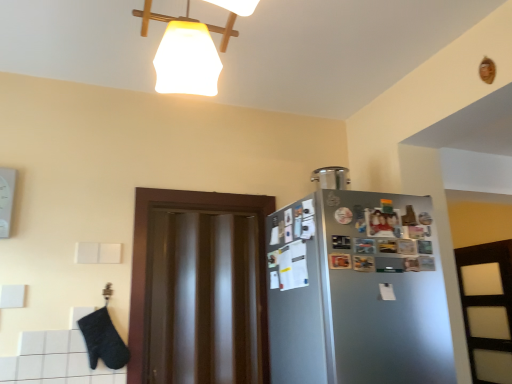
The width and height of the screenshot is (512, 384). Describe the element at coordinates (199, 288) in the screenshot. I see `transparent glossy door at center` at that location.

The height and width of the screenshot is (384, 512). In order to click on satin silver fridge at right in this screenshot , I will do coord(356,292).

Locate an element on the screen. satin silver container at upper right is located at coordinates (331, 177).

Which is in front, point (291, 344) or point (327, 170)?

The point (291, 344) is closer to the camera.

From the image's perspective, is satin silver fridge at right positioned above or below satin silver container at upper right?

satin silver fridge at right is below satin silver container at upper right.

From a real-world perspective, is satin silver fridge at right on top of satin silver container at upper right?

No, from a real-world perspective, satin silver fridge at right is not over satin silver container at upper right

Could you tell me if satin silver fridge at right is facing satin silver container at upper right?

No, satin silver fridge at right is not oriented towards satin silver container at upper right.

Considering the sizes of objects satin silver container at upper right and satin silver fridge at right in the image provided, who is shorter, satin silver container at upper right or satin silver fridge at right?

With less height is satin silver container at upper right.

Considering the sizes of objects satin silver container at upper right and satin silver fridge at right in the image provided, who is smaller, satin silver container at upper right or satin silver fridge at right?

satin silver container at upper right.

Does satin silver container at upper right contain satin silver fridge at right?

That's incorrect, satin silver fridge at right is not inside satin silver container at upper right.

Does satin silver container at upper right lie in front of satin silver fridge at right?

No, it is behind satin silver fridge at right.

Which object is more forward, satin silver container at upper right or transparent glossy door at center?

transparent glossy door at center.

Based on the photo, is satin silver container at upper right aimed at transparent glossy door at center?

No, satin silver container at upper right is not aimed at transparent glossy door at center.

Locate an element on the screen. appliance on the right of transparent glossy door at center is located at coordinates (331, 177).

Can transparent glossy door at center be found inside satin silver container at upper right?

No, transparent glossy door at center is located outside of satin silver container at upper right.

In terms of size, does transparent glossy door at center appear bigger or smaller than satin silver fridge at right?

transparent glossy door at center is smaller than satin silver fridge at right.

Based on the photo, is transparent glossy door at center oriented away from satin silver fridge at right?

No, transparent glossy door at center is not facing the opposite direction of satin silver fridge at right.

Which object is closer to the camera, transparent glossy door at center or satin silver fridge at right?

Positioned in front is satin silver fridge at right.

From the picture: In the image, is transparent glossy door at center positioned in front of or behind satin silver container at upper right?

In the image, transparent glossy door at center appears in front of satin silver container at upper right.

Considering the relative sizes of transparent glossy door at center and satin silver container at upper right in the image provided, is transparent glossy door at center smaller than satin silver container at upper right?

Incorrect, transparent glossy door at center is not smaller in size than satin silver container at upper right.

Does transparent glossy door at center have a greater height compared to satin silver container at upper right?

Correct, transparent glossy door at center is much taller as satin silver container at upper right.

Does satin silver fridge at right have a larger size compared to transparent glossy door at center?

Yes.

From a real-world perspective, is satin silver fridge at right physically above transparent glossy door at center?

Actually, satin silver fridge at right is physically below transparent glossy door at center in the real world.

Looking at this image, is transparent glossy door at center at the back of satin silver fridge at right?

That's not correct — satin silver fridge at right is not looking away from transparent glossy door at center.

Where is `refrigerator on the right of the satin silver container at upper right`? The image size is (512, 384). refrigerator on the right of the satin silver container at upper right is located at coordinates (356, 292).

You are a GUI agent. You are given a task and a screenshot of the screen. Output one action in this format:
    pyautogui.click(x=<x>, y=<y>)
    Task: Click on the refrigerator below the satin silver container at upper right (from the image's perspective)
    
    Given the screenshot: What is the action you would take?
    pyautogui.click(x=356, y=292)

When comparing their distances from satin silver fridge at right, does satin silver container at upper right or transparent glossy door at center seem further?

satin silver container at upper right is further to satin silver fridge at right.

From the image, which object appears to be nearer to satin silver container at upper right, satin silver fridge at right or transparent glossy door at center?

satin silver fridge at right is closer to satin silver container at upper right.

Based on their spatial positions, is satin silver container at upper right or satin silver fridge at right closer to transparent glossy door at center?

satin silver fridge at right is positioned closer to the anchor transparent glossy door at center.

Which object lies nearer to the anchor point satin silver fridge at right, transparent glossy door at center or satin silver container at upper right?

transparent glossy door at center.

Estimate the real-world distances between objects in this image. Which object is further from transparent glossy door at center, satin silver fridge at right or satin silver container at upper right?

satin silver container at upper right is further to transparent glossy door at center.

Which object lies further to the anchor point satin silver container at upper right, transparent glossy door at center or satin silver fridge at right?

Based on the image, transparent glossy door at center appears to be further to satin silver container at upper right.

Image resolution: width=512 pixels, height=384 pixels. I want to click on appliance between transparent glossy door at center and satin silver fridge at right in the horizontal direction, so click(331, 177).